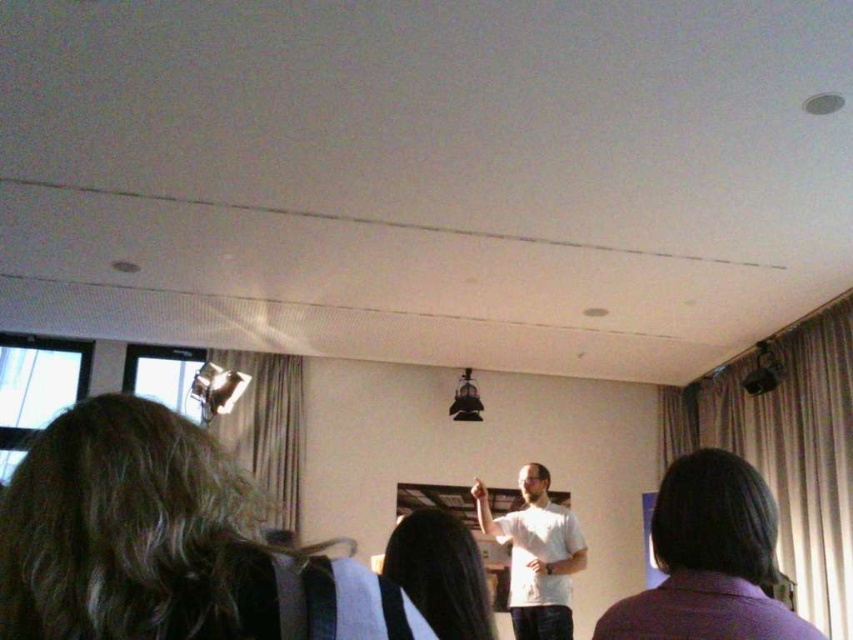
Question: Which of these objects is positioned closest to the white matte shirt at center?

Choices:
 (A) smooth black hair at center
 (B) dark brown hair at lower left

Answer: (A)

Question: Considering the relative positions of dark brown hair at lower left and white matte shirt at center in the image provided, where is dark brown hair at lower left located with respect to white matte shirt at center?

Choices:
 (A) below
 (B) above

Answer: (B)

Question: Among these points, which one is farthest from the camera?

Choices:
 (A) (717, 582)
 (B) (383, 563)
 (C) (152, 499)
 (D) (547, 497)

Answer: (D)

Question: From the image, what is the correct spatial relationship of purple fabric hair at lower right in relation to smooth black hair at center?

Choices:
 (A) right
 (B) left

Answer: (A)

Question: Does purple fabric hair at lower right appear over smooth black hair at center?

Choices:
 (A) yes
 (B) no

Answer: (A)

Question: Which point is farther from the camera taking this photo?

Choices:
 (A) (717, 448)
 (B) (437, 547)

Answer: (A)